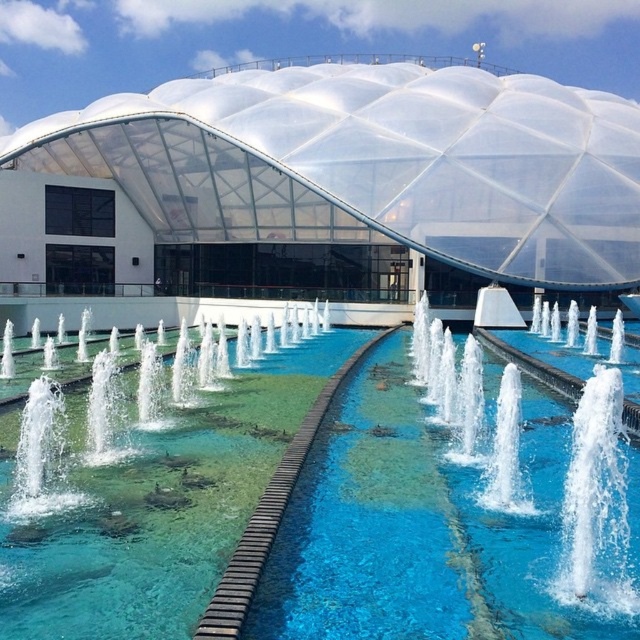
Which is behind, point (401, 339) or point (582, 132)?

The point (582, 132) is behind.

Between clear glass swimming pool at center and transparent plastic dome at center, which one is positioned lower?

clear glass swimming pool at center is below.

Does point (180, 602) lie in front of point (349, 236)?

Yes, point (180, 602) is in front of point (349, 236).

Locate an element on the screen. This screenshot has width=640, height=640. clear glass swimming pool at center is located at coordinates (429, 529).

Between point (36, 544) and point (429, 321), which one is positioned behind?

The point (429, 321) is behind.

Who is positioned more to the left, clear glass swimming pool at center or clear water jets at center?

From the viewer's perspective, clear glass swimming pool at center appears more on the left side.

The image size is (640, 640). I want to click on clear glass swimming pool at center, so click(429, 529).

The height and width of the screenshot is (640, 640). Identify the location of clear glass swimming pool at center. [x=429, y=529].

Who is higher up, transparent plastic dome at center or clear water jets at center?

Positioned higher is transparent plastic dome at center.

Where is `transparent plastic dome at center`? transparent plastic dome at center is located at coordinates (358, 179).